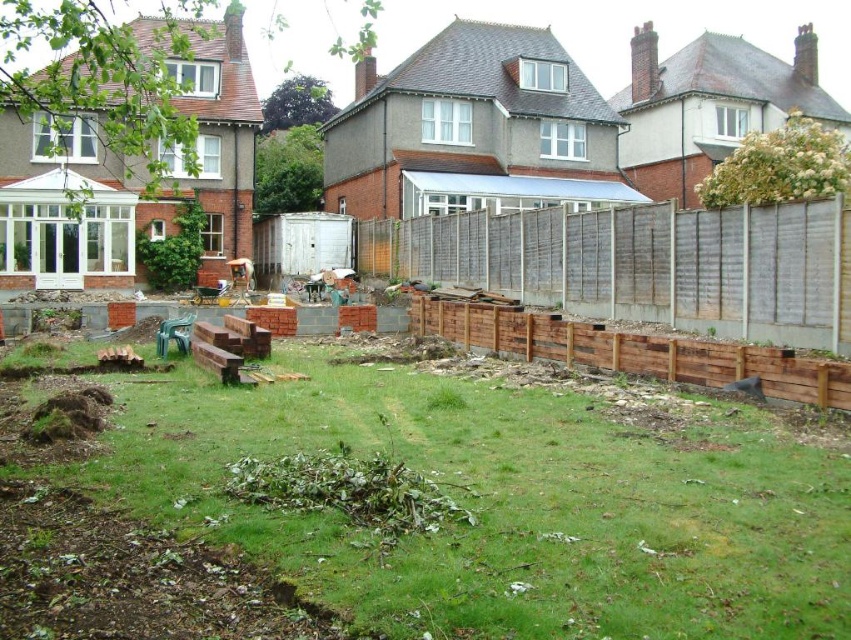
Question: Which of the following is the closest to the observer?

Choices:
 (A) (438, 452)
 (B) (786, 250)

Answer: (A)

Question: Which point is farther from the camera taking this photo?

Choices:
 (A) (448, 257)
 (B) (802, 468)

Answer: (A)

Question: Which of the following is the closest to the observer?

Choices:
 (A) green grass at center
 (B) brown wooden fence at center

Answer: (A)

Question: Does green grass at center appear on the right side of brown wooden fence at center?

Choices:
 (A) no
 (B) yes

Answer: (A)

Question: Observing the image, what is the correct spatial positioning of green grass at center in reference to brown wooden fence at center?

Choices:
 (A) right
 (B) left

Answer: (B)

Question: Can you confirm if green grass at center is positioned to the right of brown wooden fence at center?

Choices:
 (A) no
 (B) yes

Answer: (A)